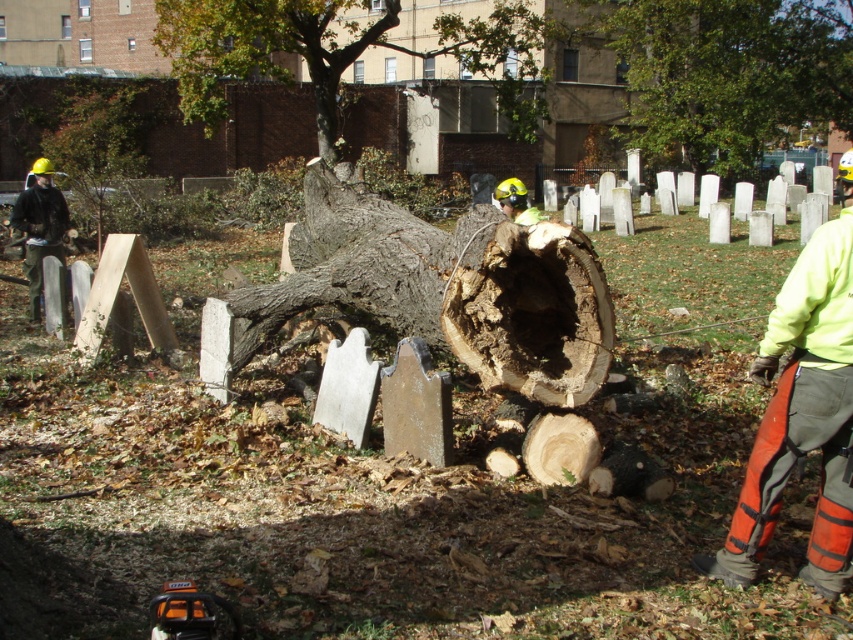
Does green leafy tree at upper center have a greater height compared to matte black jacket at left?

Indeed, green leafy tree at upper center has a greater height compared to matte black jacket at left.

Who is shorter, green leafy tree at upper center or matte black jacket at left?

matte black jacket at left is shorter.

Between point (194, 4) and point (44, 214), which one is positioned in front?

Positioned in front is point (44, 214).

Image resolution: width=853 pixels, height=640 pixels. In order to click on green leafy tree at upper center in this screenshot , I will do `click(340, 52)`.

Is neon yellow jacket at right shorter than matte black jacket at left?

Correct, neon yellow jacket at right is not as tall as matte black jacket at left.

Which is above, neon yellow jacket at right or matte black jacket at left?

Positioned higher is matte black jacket at left.

You are a GUI agent. You are given a task and a screenshot of the screen. Output one action in this format:
    pyautogui.click(x=<x>, y=<y>)
    Task: Click on the neon yellow jacket at right
    This screenshot has width=853, height=640.
    Given the screenshot: What is the action you would take?
    pyautogui.click(x=802, y=412)

Does neon yellow jacket at right lie in front of green leafy tree at upper center?

Yes, it is.

Is point (846, 244) farther from camera compared to point (215, 65)?

No, (846, 244) is closer to viewer.

Does point (830, 499) lie in front of point (395, 1)?

Yes, it is.

You are a GUI agent. You are given a task and a screenshot of the screen. Output one action in this format:
    pyautogui.click(x=<x>, y=<y>)
    Task: Click on the neon yellow jacket at right
    This screenshot has width=853, height=640.
    Given the screenshot: What is the action you would take?
    pyautogui.click(x=802, y=412)